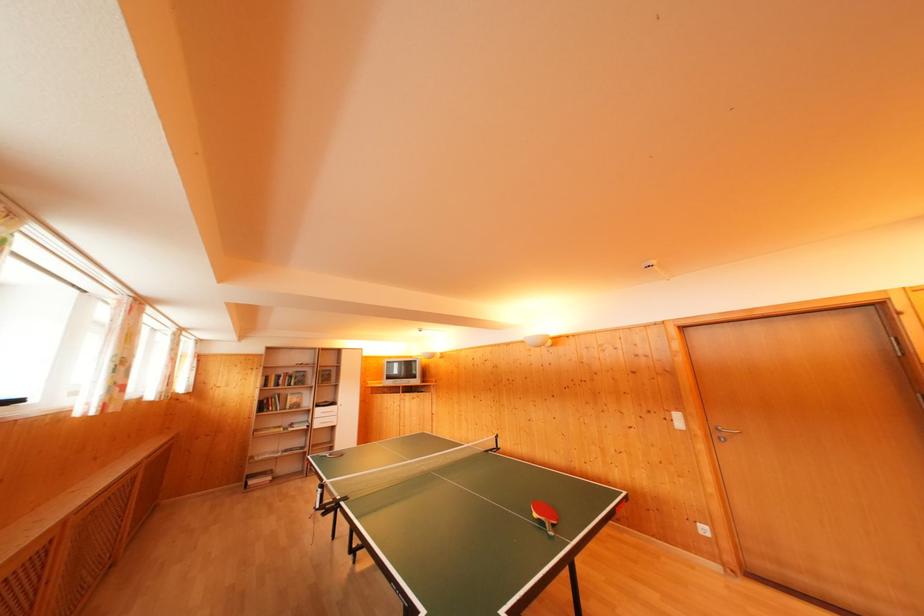
What are the coordinates of `silver door handle` in the screenshot? It's located at (724, 432).